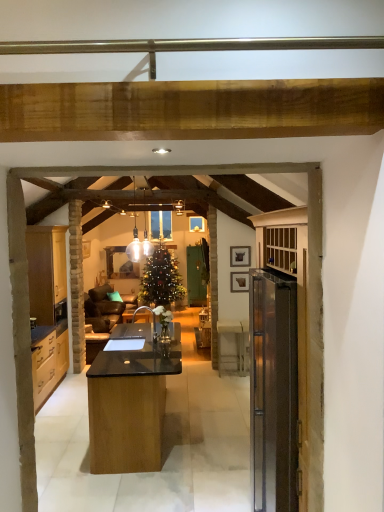
Question: Looking at their shapes, would you say wooden picture frame at upper right, the 1th picture frame ordered from the bottom, is wider or thinner than white glass pendant light at center?

Choices:
 (A) thin
 (B) wide

Answer: (A)

Question: From the image's perspective, is wooden picture frame at upper right, the 1th picture frame ordered from the bottom, above or below white glass pendant light at center?

Choices:
 (A) above
 (B) below

Answer: (B)

Question: Which of these objects is positioned farthest from the white glass pendant light at center?

Choices:
 (A) matte wood cabinets at left
 (B) matte black picture frame at upper center, the 1th picture frame in the top-to-bottom sequence
 (C) wooden picture frame at upper right, which is the second picture frame from top to bottom

Answer: (C)

Question: Based on their relative distances, which object is nearer to the matte black picture frame at upper center, the 1th picture frame in the top-to-bottom sequence?

Choices:
 (A) matte wood cabinets at left
 (B) white glass pendant light at center
 (C) wooden picture frame at upper right, the 1th picture frame ordered from the bottom

Answer: (C)